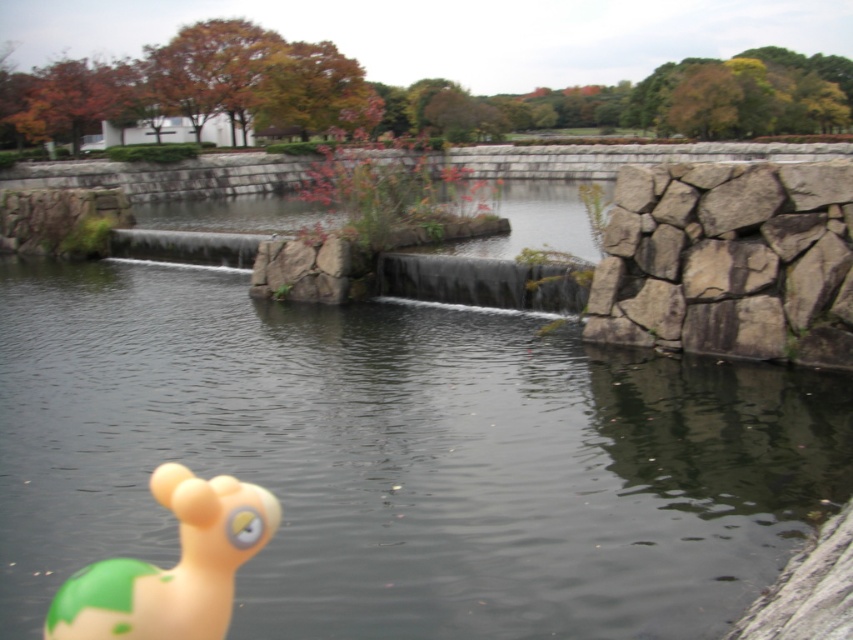
Question: Is transparent water at center bigger than gray rough stone at right?

Choices:
 (A) no
 (B) yes

Answer: (B)

Question: Which object is farther from the camera taking this photo?

Choices:
 (A) rubber duck at lower left
 (B) transparent water at center

Answer: (B)

Question: Which of the following is the farthest from the observer?

Choices:
 (A) (685, 340)
 (B) (215, 573)
 (C) (170, 426)

Answer: (A)

Question: Considering the relative positions of transparent water at center and rubber duck at lower left in the image provided, where is transparent water at center located with respect to rubber duck at lower left?

Choices:
 (A) left
 (B) right

Answer: (B)

Question: Estimate the real-world distances between objects in this image. Which object is closer to the gray rough stone at right?

Choices:
 (A) rubber duck at lower left
 (B) transparent water at center

Answer: (B)

Question: Observing the image, what is the correct spatial positioning of transparent water at center in reference to gray rough stone at right?

Choices:
 (A) left
 (B) right

Answer: (A)